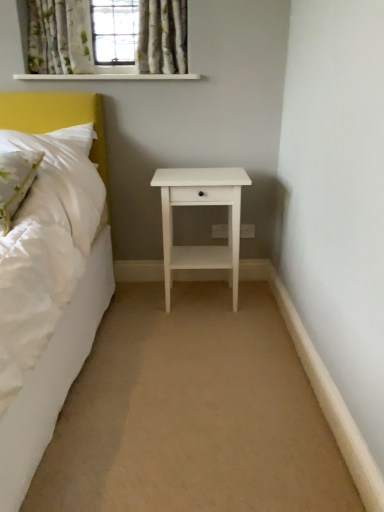
Identify the location of free location in front of white matte nightstand at center. (207, 338).